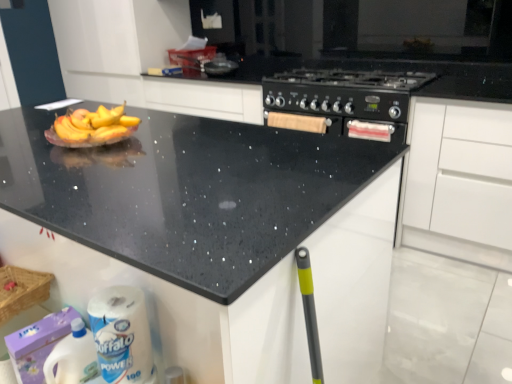
Question: Is the position of white plastic bottle at lower left more distant than that of white paper towel at lower left?

Choices:
 (A) no
 (B) yes

Answer: (B)

Question: Does white plastic bottle at lower left have a smaller size compared to white paper towel at lower left?

Choices:
 (A) no
 (B) yes

Answer: (B)

Question: Is the surface of white plastic bottle at lower left in direct contact with white paper towel at lower left?

Choices:
 (A) yes
 (B) no

Answer: (B)

Question: Considering the relative sizes of white plastic bottle at lower left and white paper towel at lower left in the image provided, is white plastic bottle at lower left bigger than white paper towel at lower left?

Choices:
 (A) yes
 (B) no

Answer: (B)

Question: Can you confirm if white plastic bottle at lower left is thinner than white paper towel at lower left?

Choices:
 (A) no
 (B) yes

Answer: (A)

Question: Is black speckled granite at upper center wider or thinner than white plastic bottle at lower left?

Choices:
 (A) wide
 (B) thin

Answer: (A)

Question: Would you say black speckled granite at upper center is to the left or to the right of white plastic bottle at lower left in the picture?

Choices:
 (A) right
 (B) left

Answer: (A)

Question: Relative to white plastic bottle at lower left, is black speckled granite at upper center in front or behind?

Choices:
 (A) front
 (B) behind

Answer: (A)

Question: Looking at the image, does black speckled granite at upper center seem bigger or smaller compared to white plastic bottle at lower left?

Choices:
 (A) small
 (B) big

Answer: (B)

Question: From the image's perspective, relative to black speckled granite at upper center, is black matte stove at center above or below?

Choices:
 (A) above
 (B) below

Answer: (A)

Question: In the image, is black matte stove at center on the left side or the right side of black speckled granite at upper center?

Choices:
 (A) left
 (B) right

Answer: (B)

Question: In the image, is black matte stove at center positioned in front of or behind black speckled granite at upper center?

Choices:
 (A) front
 (B) behind

Answer: (B)

Question: Is point (303, 119) closer or farther from the camera than point (100, 248)?

Choices:
 (A) closer
 (B) farther

Answer: (B)

Question: In terms of size, does white paper towel at lower left appear bigger or smaller than black matte stove at center?

Choices:
 (A) small
 (B) big

Answer: (A)

Question: Based on their positions, is white paper towel at lower left located to the left or right of black matte stove at center?

Choices:
 (A) right
 (B) left

Answer: (B)